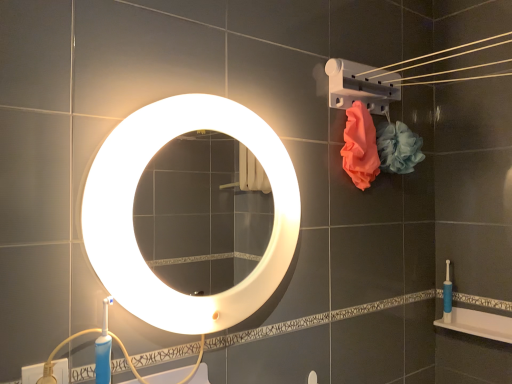
Question: Should I look upward or downward to see blue rubber toilet brush at right?

Choices:
 (A) down
 (B) up

Answer: (A)

Question: From a real-world perspective, is soft pink mesh sponge at upper right, which ranks as the first flower in right-to-left order, on top of matte orange towel at upper right, which ranks as the 2th flower in right-to-left order?

Choices:
 (A) no
 (B) yes

Answer: (B)

Question: Is soft pink mesh sponge at upper right, positioned as the 2th flower in left-to-right order, thinner than matte orange towel at upper right, placed as the 1th flower when sorted from left to right?

Choices:
 (A) yes
 (B) no

Answer: (B)

Question: Is soft pink mesh sponge at upper right, which ranks as the first flower in right-to-left order, smaller than matte orange towel at upper right, which ranks as the 2th flower in right-to-left order?

Choices:
 (A) yes
 (B) no

Answer: (B)

Question: Can you confirm if soft pink mesh sponge at upper right, positioned as the 2th flower in left-to-right order, is taller than matte orange towel at upper right, which ranks as the 2th flower in right-to-left order?

Choices:
 (A) no
 (B) yes

Answer: (A)

Question: Can you confirm if soft pink mesh sponge at upper right, which ranks as the first flower in right-to-left order, is shorter than matte orange towel at upper right, which ranks as the 2th flower in right-to-left order?

Choices:
 (A) yes
 (B) no

Answer: (A)

Question: Are soft pink mesh sponge at upper right, positioned as the 2th flower in left-to-right order, and matte orange towel at upper right, placed as the 1th flower when sorted from left to right, far apart?

Choices:
 (A) yes
 (B) no

Answer: (B)

Question: Is white glossy bath at lower right next to soft pink mesh sponge at upper right, which ranks as the first flower in right-to-left order?

Choices:
 (A) no
 (B) yes

Answer: (A)

Question: Considering the relative positions of white glossy bath at lower right and soft pink mesh sponge at upper right, which ranks as the first flower in right-to-left order, in the image provided, is white glossy bath at lower right behind soft pink mesh sponge at upper right, which ranks as the first flower in right-to-left order,?

Choices:
 (A) no
 (B) yes

Answer: (B)

Question: From a real-world perspective, is white glossy bath at lower right located beneath soft pink mesh sponge at upper right, positioned as the 2th flower in left-to-right order?

Choices:
 (A) no
 (B) yes

Answer: (B)

Question: Is white glossy bath at lower right far away from soft pink mesh sponge at upper right, positioned as the 2th flower in left-to-right order?

Choices:
 (A) no
 (B) yes

Answer: (A)

Question: Is white glossy bath at lower right bigger than soft pink mesh sponge at upper right, positioned as the 2th flower in left-to-right order?

Choices:
 (A) no
 (B) yes

Answer: (A)

Question: Could you tell me if white glossy bath at lower right is turned towards soft pink mesh sponge at upper right, which ranks as the first flower in right-to-left order?

Choices:
 (A) no
 (B) yes

Answer: (A)

Question: From the image's perspective, is matte orange towel at upper right, which ranks as the 2th flower in right-to-left order, below white glossy mirror at center?

Choices:
 (A) yes
 (B) no

Answer: (B)